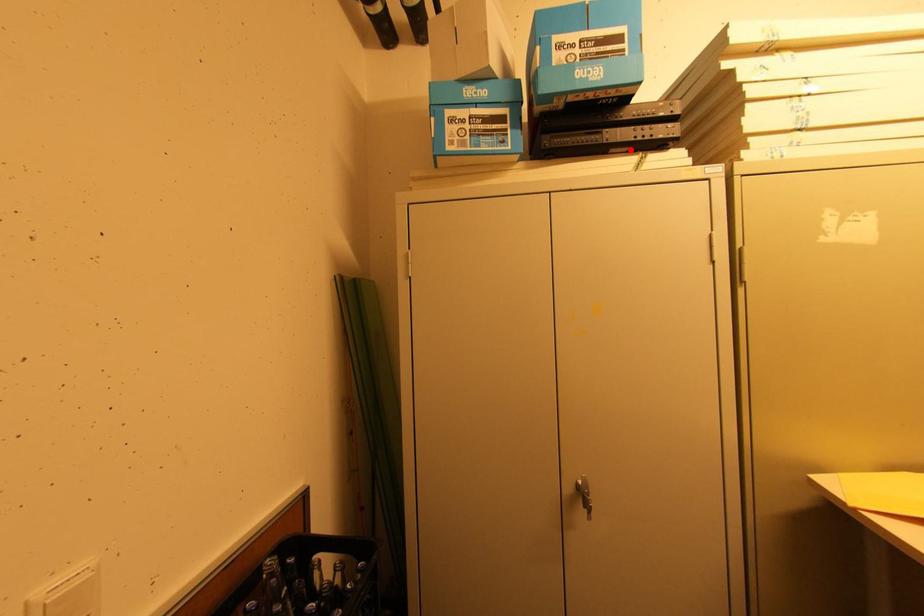
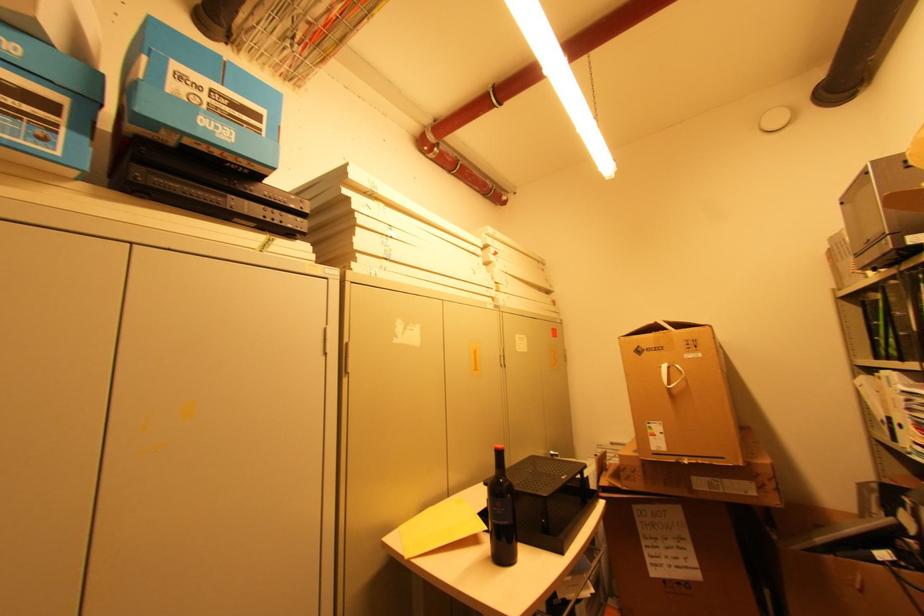
Where in the second image is the point corresponding to the highlighted location from the first image?

(258, 225)